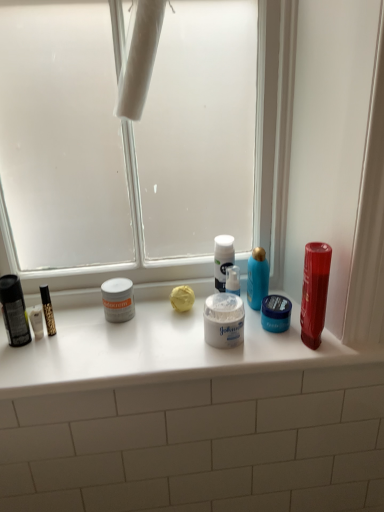
At what (x,y) coordinates should I click in order to perform the action: click on vacant space to the right of white matte jar at center. Please return your answer as a coordinate pair (x, y). The image size is (384, 512). Looking at the image, I should click on (289, 340).